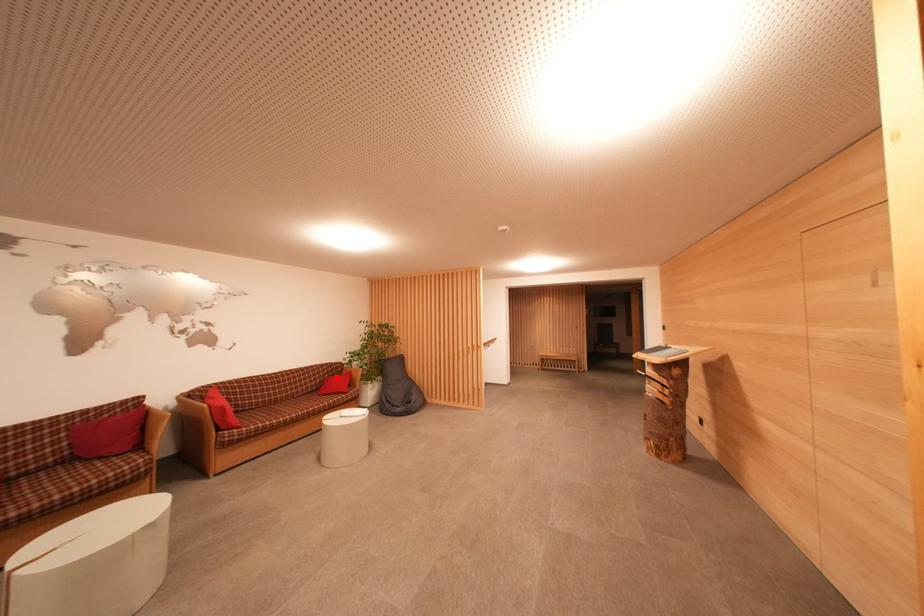
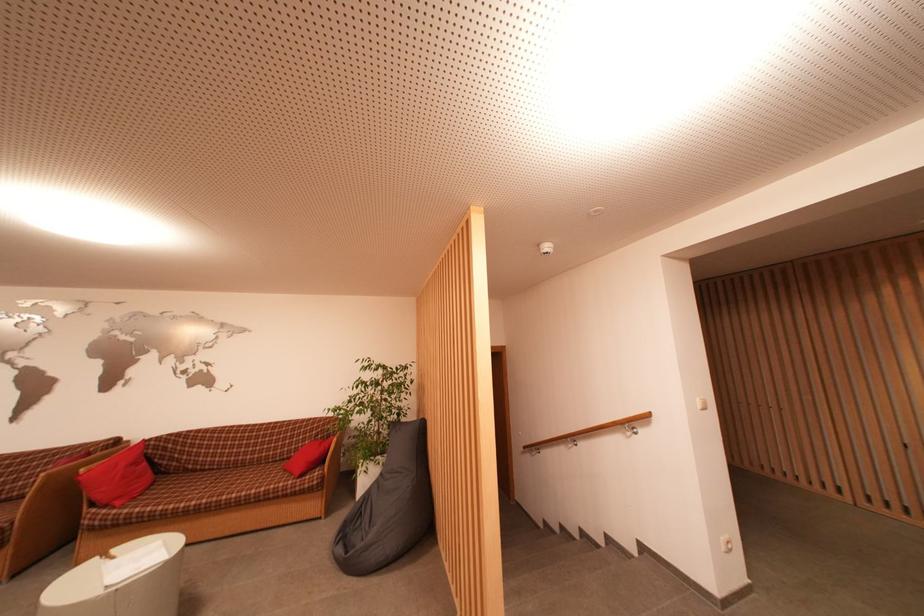
Locate, in the second image, the point that corresponds to the highlighted location in the first image.

(333, 439)